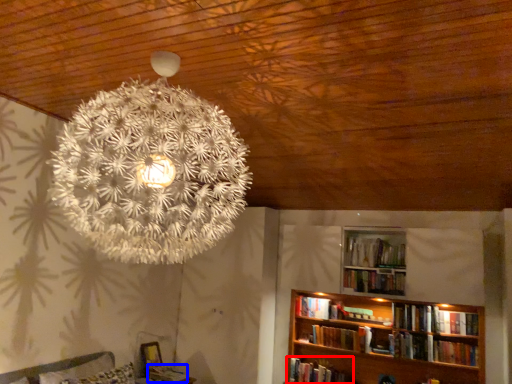
Question: Among these objects, which one is farthest to the camera, book (highlighted by a red box) or book (highlighted by a blue box)?

Choices:
 (A) book
 (B) book

Answer: (A)